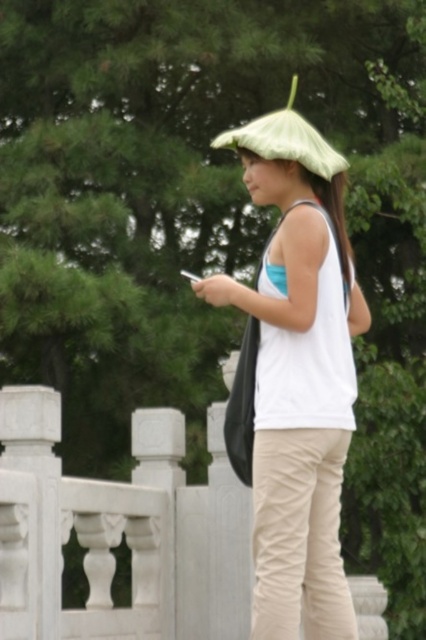
Between white stone fence at center and matte khaki pants at lower center, which one has more height?

matte khaki pants at lower center

Who is more distant from viewer, (236, 593) or (331, 496)?

Point (236, 593)

Locate an element on the screen. white stone fence at center is located at coordinates (120, 531).

Is matte green umbrella at center smaller than matte khaki pants at lower center?

No, matte green umbrella at center is not smaller than matte khaki pants at lower center.

Which is below, matte green umbrella at center or matte khaki pants at lower center?

matte khaki pants at lower center

At what (x,y) coordinates should I click in order to perform the action: click on matte green umbrella at center. Please return your answer as a coordinate pair (x, y). The width and height of the screenshot is (426, 640). Looking at the image, I should click on (298, 374).

Which of these two, matte khaki pants at lower center or green fabric umbrella at upper center, stands shorter?

matte khaki pants at lower center is shorter.

Is the position of matte khaki pants at lower center more distant than that of green fabric umbrella at upper center?

No, it is in front of green fabric umbrella at upper center.

At what (x,y) coordinates should I click in order to perform the action: click on matte khaki pants at lower center. Please return your answer as a coordinate pair (x, y). Looking at the image, I should click on (299, 536).